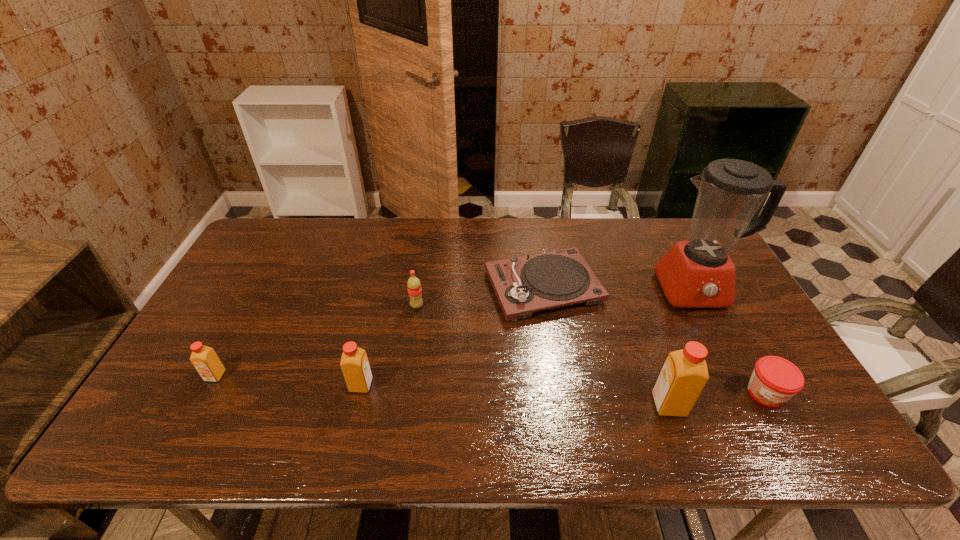
Locate an element on the screen. The height and width of the screenshot is (540, 960). free space at the far right corner of the desktop is located at coordinates (668, 241).

Locate an element on the screen. This screenshot has width=960, height=540. vacant space that is in between the shortest orange juice and the fourth object from left to right is located at coordinates (379, 332).

What are the coordinates of `free space between the fourth object from right to left and the shortest orange juice` in the screenshot? It's located at (379, 332).

I want to click on free space between the soda and the jam, so click(x=591, y=349).

At what (x,y) coordinates should I click in order to perform the action: click on free space that is in between the fifth object from left to right and the second shortest orange juice. Please return your answer as a coordinate pair (x, y). The width and height of the screenshot is (960, 540). Looking at the image, I should click on (515, 395).

You are a GUI agent. You are given a task and a screenshot of the screen. Output one action in this format:
    pyautogui.click(x=<x>, y=<y>)
    Task: Click on the empty space that is in between the fourth object from left to right and the leftmost object
    The width and height of the screenshot is (960, 540).
    Given the screenshot: What is the action you would take?
    379,332

Where is `vacant space that's between the second object from left to right and the soda`? This screenshot has height=540, width=960. vacant space that's between the second object from left to right and the soda is located at coordinates (389, 346).

At what (x,y) coordinates should I click in order to perform the action: click on vacant point located between the blender and the rightmost orange juice. Please return your answer as a coordinate pair (x, y). This screenshot has width=960, height=540. Looking at the image, I should click on (681, 347).

Identify the location of vacant point located between the soda and the second tallest orange juice. This screenshot has height=540, width=960. (389, 346).

Locate an element on the screen. This screenshot has height=540, width=960. free area in between the third object from left to right and the leftmost object is located at coordinates (316, 341).